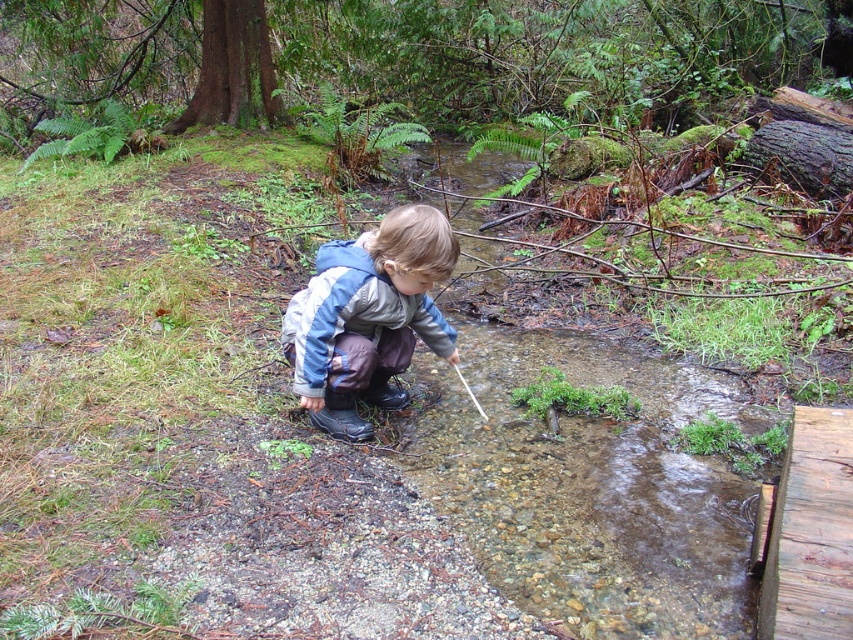
Question: Does blue denim jacket at center appear on the right side of weathered wooden plank at lower right?

Choices:
 (A) no
 (B) yes

Answer: (A)

Question: Does blue denim jacket at center appear over weathered wooden plank at lower right?

Choices:
 (A) no
 (B) yes

Answer: (B)

Question: Is blue denim jacket at center smaller than weathered wooden plank at lower right?

Choices:
 (A) yes
 (B) no

Answer: (B)

Question: Which point is closer to the camera?

Choices:
 (A) blue denim jacket at center
 (B) weathered wooden plank at lower right

Answer: (B)

Question: Which point is closer to the camera taking this photo?

Choices:
 (A) (798, 476)
 (B) (410, 294)

Answer: (A)